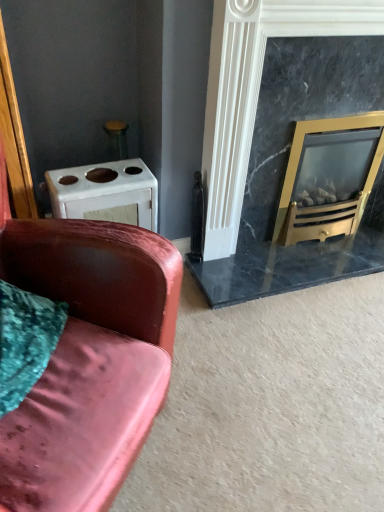
Question: From the image's perspective, relative to velvet pink couch at left, is marble fireplace at right above or below?

Choices:
 (A) below
 (B) above

Answer: (B)

Question: In terms of size, does marble fireplace at right appear bigger or smaller than velvet pink couch at left?

Choices:
 (A) big
 (B) small

Answer: (B)

Question: Which object is the farthest from the marble fireplace at right?

Choices:
 (A) velvet pink couch at left
 (B) white matte oven at upper left
 (C) gold metallic wood burning stove at right

Answer: (A)

Question: Estimate the real-world distances between objects in this image. Which object is farther from the marble fireplace at right?

Choices:
 (A) white matte oven at upper left
 (B) velvet pink couch at left
 (C) gold metallic wood burning stove at right

Answer: (B)